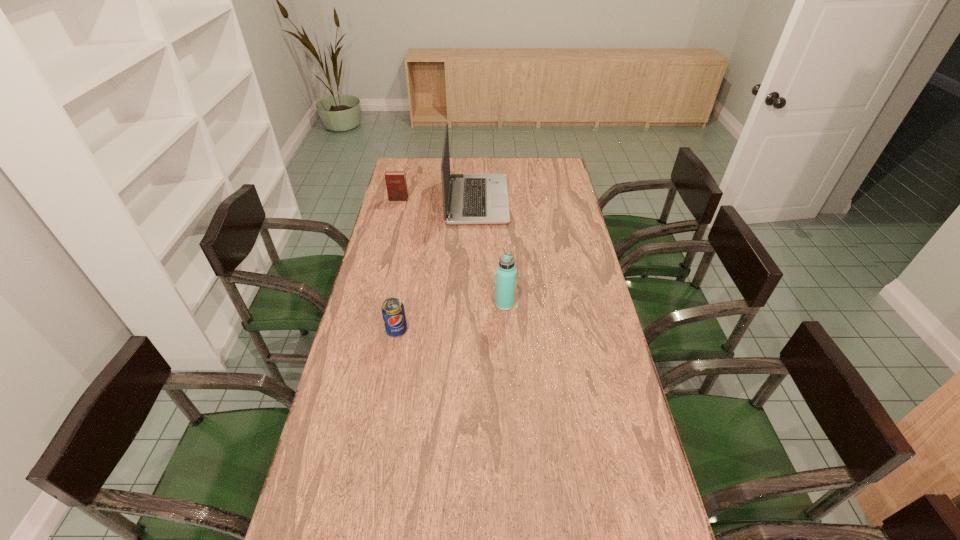
Identify the location of the tallest object. (473, 198).

At what (x,y) coordinates should I click in order to perform the action: click on the second nearest object. Please return your answer as a coordinate pair (x, y). Looking at the image, I should click on (506, 272).

At what (x,y) coordinates should I click in order to perform the action: click on the second tallest object. Please return your answer as a coordinate pair (x, y). Looking at the image, I should click on tap(506, 272).

Locate an element on the screen. Image resolution: width=960 pixels, height=540 pixels. diary is located at coordinates (396, 185).

The image size is (960, 540). Find the location of `the second object from left to right`. the second object from left to right is located at coordinates (393, 312).

Where is `soda`? soda is located at coordinates (393, 312).

You are a GUI agent. You are given a task and a screenshot of the screen. Output one action in this format:
    pyautogui.click(x=<x>, y=<y>)
    Task: Click on the vacant area located 0.300m on the screen of the tallest object
    
    Given the screenshot: What is the action you would take?
    [x=573, y=200]

The width and height of the screenshot is (960, 540). Find the location of `vacant space located 0.060m on the right of the second tallest object`. vacant space located 0.060m on the right of the second tallest object is located at coordinates (531, 304).

This screenshot has height=540, width=960. In order to click on vacant space located 0.270m on the front cover of the diary in this screenshot , I will do `click(389, 238)`.

Image resolution: width=960 pixels, height=540 pixels. Identify the location of vacant space located 0.140m on the front of the third object from right to left. (389, 375).